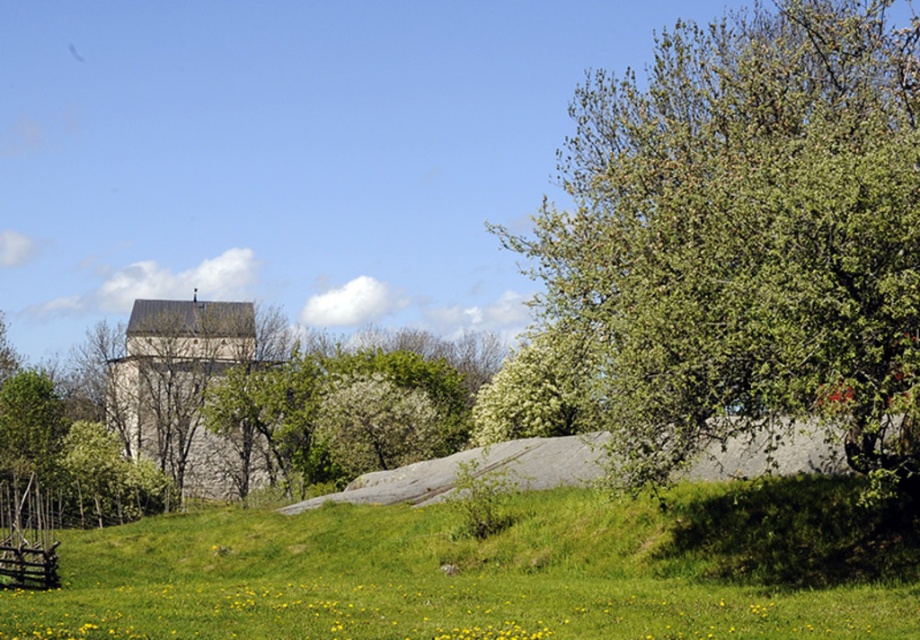
Question: Can you confirm if green leafy tree at right is bigger than brown wooden fence at lower left?

Choices:
 (A) no
 (B) yes

Answer: (B)

Question: Which of the following is the closest to the observer?

Choices:
 (A) green grassy hill at lower center
 (B) brown wooden fence at lower left
 (C) gray stone church at center

Answer: (A)

Question: Which point is closer to the camera?

Choices:
 (A) green leafy tree at right
 (B) gray stone church at center
 (C) brown wooden fence at lower left

Answer: (A)

Question: Which point is closer to the camera?

Choices:
 (A) green grassy hill at lower center
 (B) green leafy tree at right
 (C) brown wooden fence at lower left
 (D) gray stone church at center

Answer: (A)

Question: Can you confirm if green leafy tree at right is bigger than brown wooden fence at lower left?

Choices:
 (A) no
 (B) yes

Answer: (B)

Question: Does green leafy tree at right have a greater width compared to gray stone church at center?

Choices:
 (A) no
 (B) yes

Answer: (B)